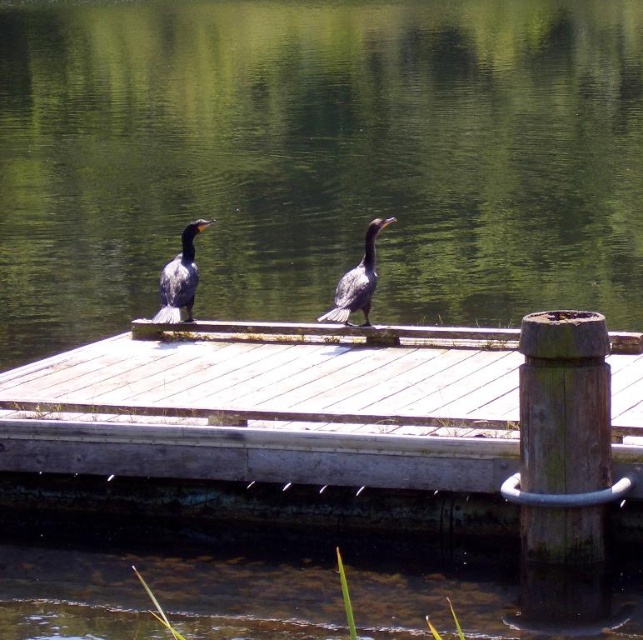
How distant is gray matte bird at left from gray matte bird at center?

They are 1.26 meters apart.

Does gray matte bird at left have a greater height compared to gray matte bird at center?

In fact, gray matte bird at left may be shorter than gray matte bird at center.

Identify the location of gray matte bird at left. This screenshot has height=640, width=643. pos(179,276).

Is white wood dock at center to the right of gray matte bird at left from the viewer's perspective?

Yes, white wood dock at center is to the right of gray matte bird at left.

Does white wood dock at center have a smaller size compared to gray matte bird at left?

Incorrect, white wood dock at center is not smaller in size than gray matte bird at left.

Locate an element on the screen. Image resolution: width=643 pixels, height=640 pixels. white wood dock at center is located at coordinates (273, 426).

Is white wood dock at center bigger than gray matte bird at center?

Yes, white wood dock at center is bigger than gray matte bird at center.

Can you confirm if white wood dock at center is thinner than gray matte bird at center?

No.

Is point (95, 344) farther from viewer compared to point (368, 284)?

Yes, it is behind point (368, 284).

This screenshot has height=640, width=643. I want to click on white wood dock at center, so click(x=273, y=426).